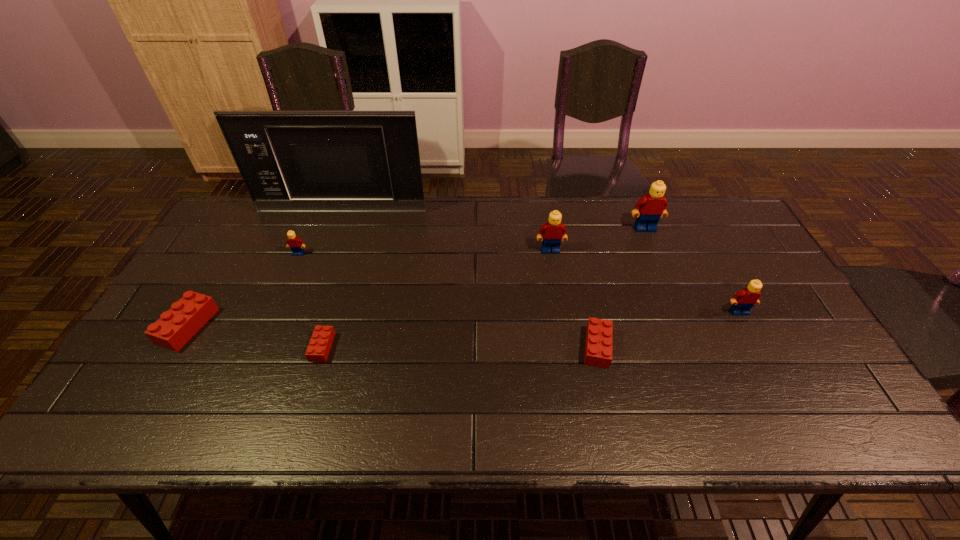
The height and width of the screenshot is (540, 960). I want to click on yellow Lego that is the third nearest to the shortest object, so pos(653,205).

Where is `red Lego object that ranks as the second closest to the second smallest red Lego`? This screenshot has height=540, width=960. red Lego object that ranks as the second closest to the second smallest red Lego is located at coordinates (175, 327).

Select which red Lego appears as the closest to the seventh tallest object. Please provide its 2D coordinates. Your answer should be formatted as a tuple, i.e. [(x, y)], where the tuple contains the x and y coordinates of a point satisfying the conditions above.

[(320, 343)]